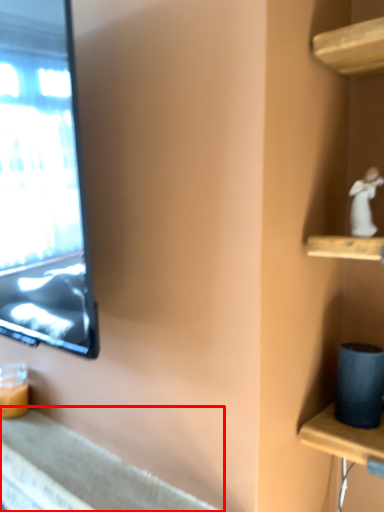
Question: From the image's perspective, what is the correct spatial relationship of counter top (annotated by the red box) in relation to miniature?

Choices:
 (A) above
 (B) below

Answer: (B)